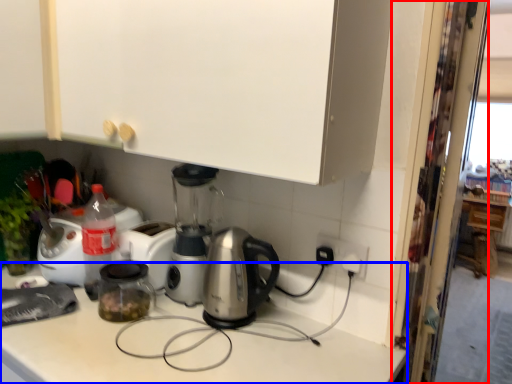
Question: Which point is further to the camera, screen door (highlighted by a red box) or counter top (highlighted by a blue box)?

Choices:
 (A) screen door
 (B) counter top

Answer: (A)